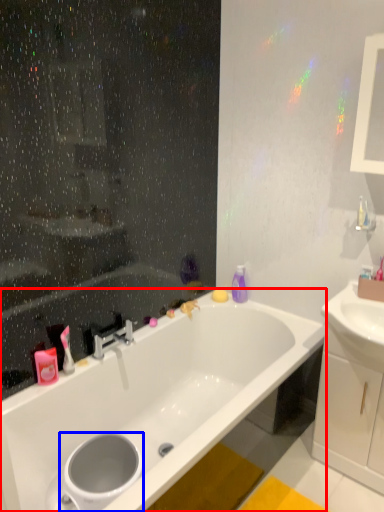
Question: Among these objects, which one is nearest to the camera, bathtub (highlighted by a red box) or toilet bowl (highlighted by a blue box)?

Choices:
 (A) bathtub
 (B) toilet bowl

Answer: (A)